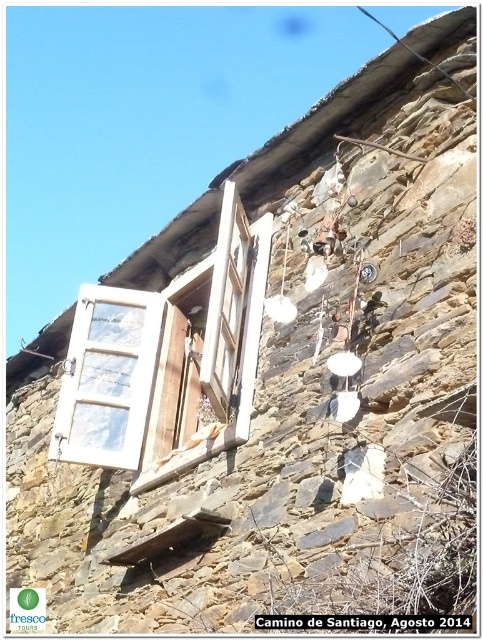
Can you confirm if white plastic window at upper left is taller than white wood window at center?

In fact, white plastic window at upper left may be shorter than white wood window at center.

Consider the image. Does white plastic window at upper left appear on the left side of white wood window at center?

Correct, you'll find white plastic window at upper left to the left of white wood window at center.

Which is in front, point (114, 310) or point (251, 288)?

Positioned in front is point (251, 288).

Where is `white plastic window at upper left`? Image resolution: width=483 pixels, height=640 pixels. white plastic window at upper left is located at coordinates (108, 378).